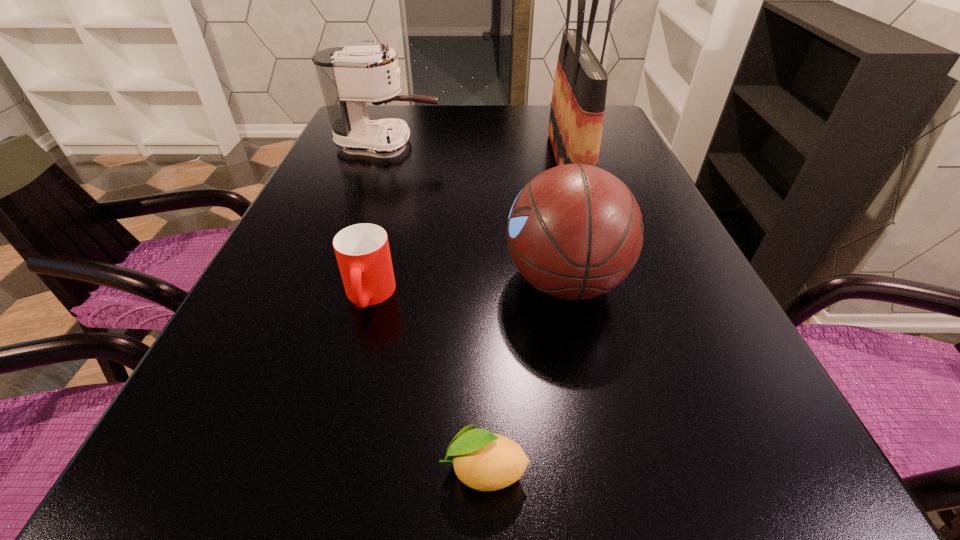
Identify the location of free space between the lemon and the basketball. (524, 375).

Where is `vacant space that is in between the lemon and the coffee maker`? vacant space that is in between the lemon and the coffee maker is located at coordinates (436, 307).

This screenshot has height=540, width=960. I want to click on unoccupied area between the shortest object and the tallest object, so click(x=526, y=316).

Find the location of a particular element. The width and height of the screenshot is (960, 540). free spot between the cup and the shopping bag is located at coordinates (468, 229).

I want to click on vacant space in between the coffee maker and the third shortest object, so click(x=476, y=213).

The height and width of the screenshot is (540, 960). I want to click on free space between the lemon and the coffee maker, so click(436, 307).

At what (x,y) coordinates should I click in order to perform the action: click on blank region between the cup and the tallest object. Please return your answer as a coordinate pair (x, y). Image resolution: width=960 pixels, height=540 pixels. Looking at the image, I should click on (468, 229).

Select which object appears as the fourth closest to the second shortest object. Please provide its 2D coordinates. Your answer should be formatted as a tuple, i.e. [(x, y)], where the tuple contains the x and y coordinates of a point satisfying the conditions above.

[(349, 77)]

This screenshot has height=540, width=960. I want to click on the closest object to the fourth tallest object, so click(575, 231).

Locate an element on the screen. The image size is (960, 540). vacant space that satisfies the following two spatial constraints: 1. on the front-facing side of the third shortest object; 2. on the right side of the coffee maker is located at coordinates (340, 281).